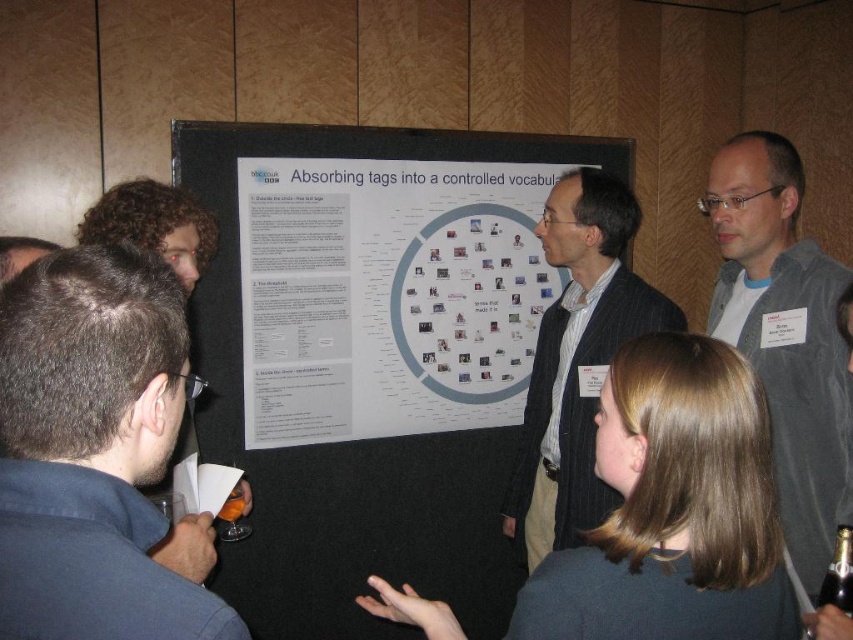
Does white paperboard at center appear on the right side of dark blue shirt at lower left?

Yes, white paperboard at center is to the right of dark blue shirt at lower left.

Image resolution: width=853 pixels, height=640 pixels. In order to click on white paperboard at center in this screenshot , I will do `click(370, 358)`.

Image resolution: width=853 pixels, height=640 pixels. In order to click on white paperboard at center in this screenshot , I will do `click(370, 358)`.

Is point (718, 170) positioned before point (621, 328)?

That is True.

Identify the location of gray fabric jacket at right. (785, 336).

Does point (485, 348) come in front of point (704, 195)?

Yes.

Which is more to the right, white paperboard poster at center or gray fabric jacket at right?

gray fabric jacket at right

Is point (520, 257) behind point (834, 451)?

Yes, point (520, 257) is farther from viewer.

Locate an element on the screen. The height and width of the screenshot is (640, 853). white paperboard poster at center is located at coordinates (387, 296).